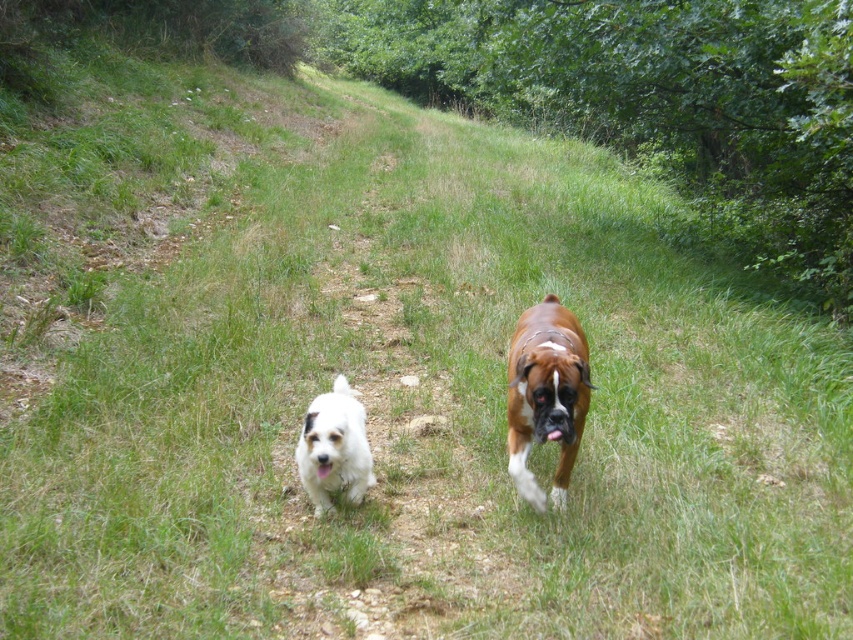
Does brown glossy dog at center have a smaller size compared to white fluffy dog at center?

No, brown glossy dog at center is not smaller than white fluffy dog at center.

Which is above, brown glossy dog at center or white fluffy dog at center?

brown glossy dog at center is above.

The height and width of the screenshot is (640, 853). Find the location of `brown glossy dog at center`. brown glossy dog at center is located at coordinates (546, 394).

At what (x,y) coordinates should I click in order to perform the action: click on brown glossy dog at center. Please return your answer as a coordinate pair (x, y). The height and width of the screenshot is (640, 853). Looking at the image, I should click on (546, 394).